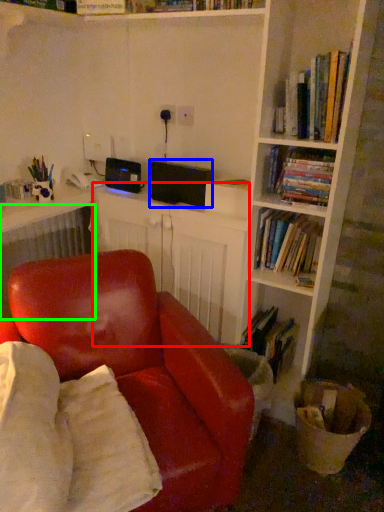
Question: Which is nearer to the computer desk (highlighted by a red box)? speaker (highlighted by a blue box) or radiator (highlighted by a green box).

Choices:
 (A) speaker
 (B) radiator

Answer: (A)